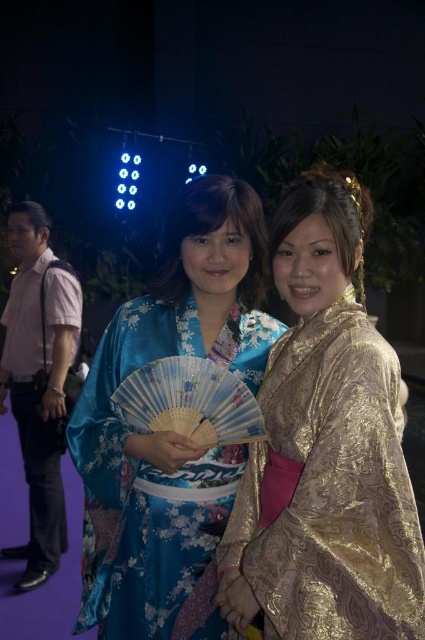
Is satin kimono at center behind pink shirt at left?

That is False.

Which is in front, point (155, 458) or point (22, 403)?

Point (155, 458) is in front.

At what (x,y) coordinates should I click in order to perform the action: click on satin kimono at center. Please return your answer as a coordinate pair (x, y). This screenshot has width=425, height=640. Looking at the image, I should click on (167, 433).

I want to click on gold shiny kimono at right, so click(x=325, y=449).

Which is below, gold shiny kimono at right or pink shirt at left?

pink shirt at left

Does point (255, 570) lie behind point (65, 321)?

No.

Where is `gold shiny kimono at right`? gold shiny kimono at right is located at coordinates (325, 449).

Between gold shiny kimono at right and satin kimono at center, which one is positioned higher?

gold shiny kimono at right

Which is more to the right, gold shiny kimono at right or satin kimono at center?

gold shiny kimono at right is more to the right.

Locate an element on the screen. The height and width of the screenshot is (640, 425). gold shiny kimono at right is located at coordinates (325, 449).